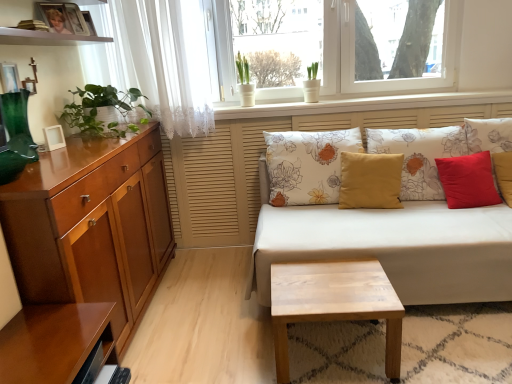
This screenshot has height=384, width=512. What are the coordinates of `glossy wood shelf at lower left` in the screenshot? It's located at tap(54, 341).

Describe the element at coordinates (91, 226) in the screenshot. I see `glossy wood cabinet at left` at that location.

This screenshot has height=384, width=512. What do you see at coordinates (307, 165) in the screenshot? I see `floral fabric cushion at center, which appears as the first pillow when viewed from the left` at bounding box center [307, 165].

Locate an element on the screen. matte yellow cushion at center, positioned as the 2th pillow in left-to-right order is located at coordinates (370, 181).

Describe the element at coordinates (393, 246) in the screenshot. This screenshot has height=384, width=512. I see `white floral fabric couch at center` at that location.

The width and height of the screenshot is (512, 384). Find the location of `glossy wood shelf at lower left`. glossy wood shelf at lower left is located at coordinates pos(54,341).

Are white glossy pot at upper center and floral fabric cushion at center, which appears as the first pillow when viewed from the left, far apart?

Actually, white glossy pot at upper center and floral fabric cushion at center, which appears as the first pillow when viewed from the left, are a little close together.

From the image's perspective, is white glossy pot at upper center on top of floral fabric cushion at center, which appears as the fifth pillow when viewed from the right?

Yes, from the image's perspective, white glossy pot at upper center is above floral fabric cushion at center, which appears as the fifth pillow when viewed from the right.

From a real-world perspective, between white glossy pot at upper center and floral fabric cushion at center, which appears as the first pillow when viewed from the left, who is vertically lower?

floral fabric cushion at center, which appears as the first pillow when viewed from the left, is physically lower.

Is white glossy pot at upper center in front of floral fabric cushion at center, which appears as the fifth pillow when viewed from the right?

No, white glossy pot at upper center is behind floral fabric cushion at center, which appears as the fifth pillow when viewed from the right.

Locate an element on the screen. coffee table that appears below the white glossy pot at upper center (from the image's perspective) is located at coordinates (334, 303).

From a real-world perspective, does light wood/texture coffee table at center stand above white glossy pot at upper center?

No, from a real-world perspective, light wood/texture coffee table at center is not on top of white glossy pot at upper center.

Is light wood/texture coffee table at center facing towards white glossy pot at upper center?

No, light wood/texture coffee table at center is not oriented towards white glossy pot at upper center.

Based on the photo, is light wood/texture coffee table at center with white glossy pot at upper center?

No, light wood/texture coffee table at center is not in contact with white glossy pot at upper center.

Is light wood/texture coffee table at center aimed at floral fabric cushion at center, which appears as the fifth pillow when viewed from the right?

No.

Considering the positions of points (333, 310) and (284, 161), is point (333, 310) farther from camera compared to point (284, 161)?

No.

Looking at this image, is light wood/texture coffee table at center at the right side of floral fabric cushion at center, which appears as the fifth pillow when viewed from the right?

No.

Is light wood/texture coffee table at center outside of floral fabric cushion at center, which appears as the first pillow when viewed from the left?

light wood/texture coffee table at center is positioned outside floral fabric cushion at center, which appears as the first pillow when viewed from the left.

Considering the sizes of white floral fabric couch at center and yellow fabric pillow at center, arranged as the third pillow when viewed from the left, in the image, is white floral fabric couch at center taller or shorter than yellow fabric pillow at center, arranged as the third pillow when viewed from the left,?

In the image, white floral fabric couch at center appears to be taller than yellow fabric pillow at center, arranged as the third pillow when viewed from the left.

Is the depth of white floral fabric couch at center less than that of yellow fabric pillow at center, arranged as the third pillow when viewed from the left?

Yes.

Is white floral fabric couch at center not inside yellow fabric pillow at center, arranged as the third pillow when viewed from the left?

white floral fabric couch at center is positioned outside yellow fabric pillow at center, arranged as the third pillow when viewed from the left.

Based on the photo, is matte yellow cushion at center, positioned as the 2th pillow in left-to-right order, at the left side of glossy wood shelf at lower left?

No, matte yellow cushion at center, positioned as the 2th pillow in left-to-right order, is not to the left of glossy wood shelf at lower left.

In terms of width, does matte yellow cushion at center, which ranks as the fourth pillow in right-to-left order, look wider or thinner when compared to glossy wood shelf at lower left?

In the image, matte yellow cushion at center, which ranks as the fourth pillow in right-to-left order, appears to be more narrow than glossy wood shelf at lower left.

Is point (402, 163) closer or farther from the camera than point (42, 346)?

Point (402, 163) is farther from the camera than point (42, 346).

Between matte yellow cushion at center, which ranks as the fourth pillow in right-to-left order, and glossy wood shelf at lower left, which one has larger size?

matte yellow cushion at center, which ranks as the fourth pillow in right-to-left order.

Considering the relative sizes of matte yellow cushion at center, positioned as the 2th pillow in left-to-right order, and green glass vase at left in the image provided, is matte yellow cushion at center, positioned as the 2th pillow in left-to-right order, taller than green glass vase at left?

Indeed, matte yellow cushion at center, positioned as the 2th pillow in left-to-right order, has a greater height compared to green glass vase at left.

From the image's perspective, is matte yellow cushion at center, which ranks as the fourth pillow in right-to-left order, on green glass vase at left?

Actually, matte yellow cushion at center, which ranks as the fourth pillow in right-to-left order, appears below green glass vase at left in the image.

In terms of size, does matte yellow cushion at center, positioned as the 2th pillow in left-to-right order, appear bigger or smaller than green glass vase at left?

In the image, matte yellow cushion at center, positioned as the 2th pillow in left-to-right order, appears to be larger than green glass vase at left.

Is matte yellow cushion at center, which ranks as the fourth pillow in right-to-left order, positioned far away from green glass vase at left?

Yes.

Is point (20, 152) positioned behind point (12, 250)?

That is True.

Would you say green glass vase at left is outside glossy wood cabinet at left?

green glass vase at left is positioned outside glossy wood cabinet at left.

From the image's perspective, is green glass vase at left on top of glossy wood cabinet at left?

Yes, from the image's perspective, green glass vase at left is on top of glossy wood cabinet at left.

Based on their sizes in the image, would you say green glass vase at left is bigger or smaller than glossy wood cabinet at left?

green glass vase at left is smaller than glossy wood cabinet at left.

You are a GUI agent. You are given a task and a screenshot of the screen. Output one action in this format:
    pyautogui.click(x=<x>, y=<y>)
    Task: Click on the 2nd pillow in front of the white glossy pot at upper center
    This screenshot has height=384, width=512.
    Given the screenshot: What is the action you would take?
    pyautogui.click(x=307, y=165)

Locate an element on the screen. plant located behind the light wood/texture coffee table at center is located at coordinates (242, 69).

From the picture: Which object lies further to the anchor point white glossy pot at upper center, glossy wood shelf at lower left or glossy wood cabinet at left?

Among the two, glossy wood shelf at lower left is located further to white glossy pot at upper center.

Based on their spatial positions, is green leafy plant at left or white floral fabric couch at center further from matte yellow cushion at center, which ranks as the fourth pillow in right-to-left order?

The object further to matte yellow cushion at center, which ranks as the fourth pillow in right-to-left order, is green leafy plant at left.

Which object lies nearer to the anchor point red velvet cushion at right, the second pillow viewed from the right, yellow fabric pillow at center, the third pillow viewed from the right, or glossy wood cabinet at left?

The object closer to red velvet cushion at right, the second pillow viewed from the right, is yellow fabric pillow at center, the third pillow viewed from the right.

Considering their positions, is green leafy plant at left positioned further to matte yellow cushion at center, positioned as the 2th pillow in left-to-right order, than red matte pillow at right, placed as the fifth pillow when sorted from left to right?

The object further to matte yellow cushion at center, positioned as the 2th pillow in left-to-right order, is green leafy plant at left.

Looking at the image, which one is located closer to red matte pillow at right, placed as the fifth pillow when sorted from left to right, white floral fabric couch at center or glossy wood cabinet at left?

The object closer to red matte pillow at right, placed as the fifth pillow when sorted from left to right, is white floral fabric couch at center.

Looking at the image, which one is located further to red matte pillow at right, the first pillow when ordered from right to left, white lace curtain at left or green glass vase at left?

Among the two, green glass vase at left is located further to red matte pillow at right, the first pillow when ordered from right to left.

Based on their spatial positions, is green glass vase at left or transparent glass window at upper center further from white floral fabric couch at center?

The object further to white floral fabric couch at center is transparent glass window at upper center.

In the scene shown: Based on their spatial positions, is green leafy plant at left or floral fabric cushion at center, which appears as the fifth pillow when viewed from the right, closer to glossy wood shelf at lower left?

green leafy plant at left is closer to glossy wood shelf at lower left.

The width and height of the screenshot is (512, 384). Find the location of `vase that lies between green leafy plant at left and glossy wood shelf at lower left from top to bottom`. vase that lies between green leafy plant at left and glossy wood shelf at lower left from top to bottom is located at coordinates (18, 124).

Identify the location of studio couch between floral fabric cushion at center, which appears as the first pillow when viewed from the left, and red matte pillow at right, placed as the fifth pillow when sorted from left to right, from left to right. (393, 246).

Locate an element on the screen. The image size is (512, 384). studio couch located between white lace curtain at left and red matte pillow at right, the first pillow when ordered from right to left, in the left-right direction is located at coordinates (393, 246).

Where is `houseplant between glossy wood cabinet at left and yellow fabric pillow at center, the third pillow viewed from the right`? This screenshot has width=512, height=384. houseplant between glossy wood cabinet at left and yellow fabric pillow at center, the third pillow viewed from the right is located at coordinates (101, 107).